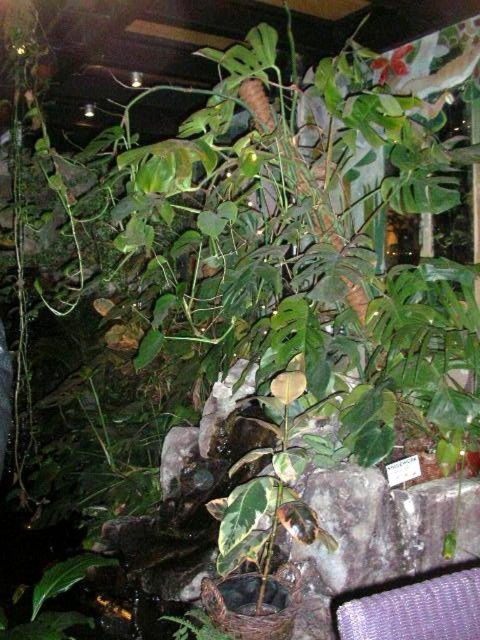
You are sitting in the purple woven chair at lower right and want to reach the green glossy leaf at center to water it. Which direction should you move to get closer to the leaf?

The purple woven chair at lower right is positioned on the right side of the green glossy leaf at center, so you should move to the left to get closer to the leaf.

You are standing in the indoor garden and want to reach a specific point marked by coordinates. The point is located at point (460, 621). Considering your height is 1.7 meters, will the large Monstera plant in the center block your view of this point?

The point (460, 621) is 1.41 meters from the viewer. Since the large Monstera plant is in the center of the frame, it might block the view depending on its height. However, the point is closer than your height, so if the plant is shorter than 1.41 meters, your view would be unobstructed. But without knowing the plant height, we can only assume based on typical Monstera sizes. Typically, Monstera plants can grow up to 2 meters tall indoors. If this one is close to that height, it might block your view. If